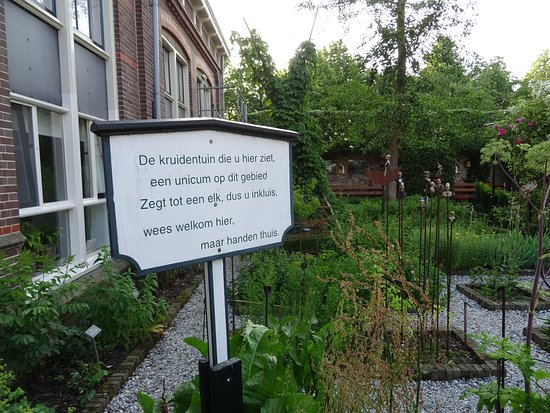
Find the location of a particular element. frame is located at coordinates (79, 210).